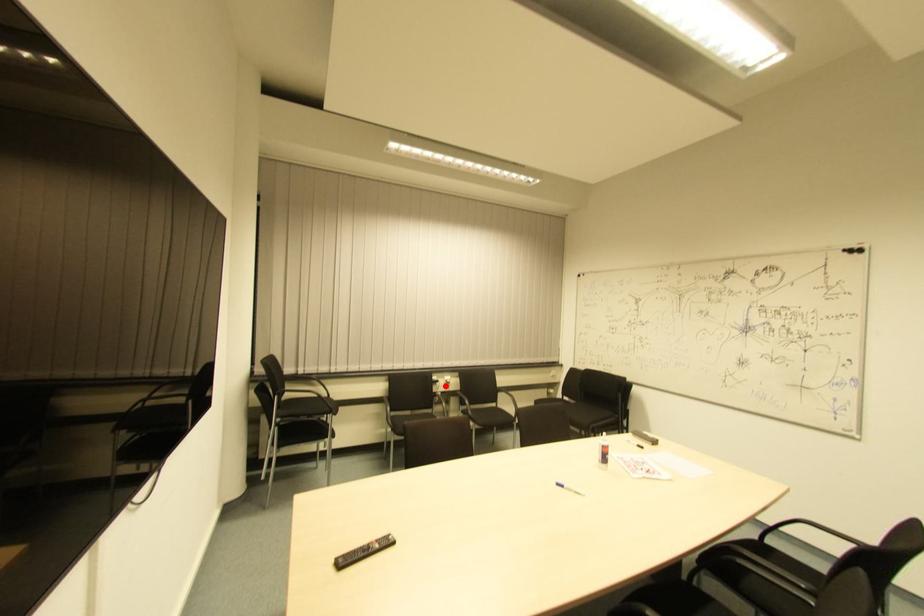
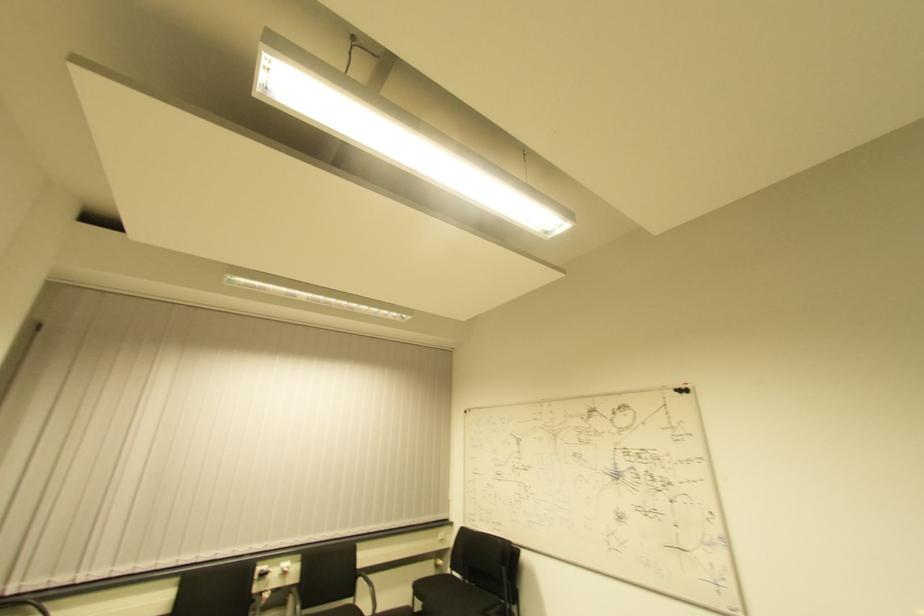
Question: I am providing you with two images of the same scene from different viewpoints. A red point is marked on the first image. Can you still see the location of the red point in image 2?

Choices:
 (A) Yes
 (B) No

Answer: (A)